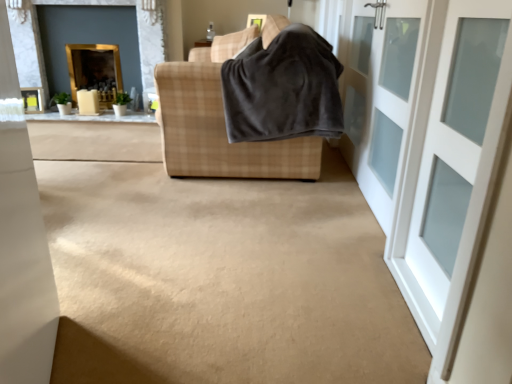
Question: Could you tell me if plaid fabric sofa at center is facing dark gray fleece blanket at center?

Choices:
 (A) no
 (B) yes

Answer: (A)

Question: Is plaid fabric sofa at center at the left side of dark gray fleece blanket at center?

Choices:
 (A) yes
 (B) no

Answer: (A)

Question: Is plaid fabric sofa at center further to the viewer compared to dark gray fleece blanket at center?

Choices:
 (A) yes
 (B) no

Answer: (A)

Question: Is plaid fabric sofa at center oriented away from dark gray fleece blanket at center?

Choices:
 (A) no
 (B) yes

Answer: (B)

Question: Is dark gray fleece blanket at center completely or partially inside plaid fabric sofa at center?

Choices:
 (A) yes
 (B) no

Answer: (A)

Question: Looking at their shapes, would you say gold-framed mirror at upper left, arranged as the 2th fireplace when viewed from the left, is wider or thinner than white glass door at right, arranged as the 1th door when viewed from the front?

Choices:
 (A) wide
 (B) thin

Answer: (A)

Question: In terms of height, does gold-framed mirror at upper left, which is the first fireplace in right-to-left order, look taller or shorter compared to white glass door at right, arranged as the 1th door when viewed from the front?

Choices:
 (A) tall
 (B) short

Answer: (A)

Question: Relative to white glass door at right, arranged as the 1th door when viewed from the front, is gold-framed mirror at upper left, arranged as the 2th fireplace when viewed from the left, in front or behind?

Choices:
 (A) behind
 (B) front

Answer: (A)

Question: From the image's perspective, relative to white glass door at right, arranged as the 1th door when viewed from the front, is gold-framed mirror at upper left, which is the first fireplace in right-to-left order, above or below?

Choices:
 (A) above
 (B) below

Answer: (A)

Question: Considering the positions of point (501, 372) and point (394, 3), is point (501, 372) closer or farther from the camera than point (394, 3)?

Choices:
 (A) closer
 (B) farther

Answer: (A)

Question: Is white glass door at right, arranged as the 1th door when viewed from the front, in front of or behind white glass door at right, marked as the 1th door in a back-to-front arrangement, in the image?

Choices:
 (A) front
 (B) behind

Answer: (A)

Question: In terms of size, does white glass door at right, arranged as the 1th door when viewed from the front, appear bigger or smaller than white glass door at right, marked as the 1th door in a back-to-front arrangement?

Choices:
 (A) big
 (B) small

Answer: (B)

Question: Is white glass door at right, acting as the second door starting from the back, situated inside white glass door at right, marked as the 1th door in a back-to-front arrangement, or outside?

Choices:
 (A) outside
 (B) inside

Answer: (A)

Question: From a real-world perspective, is gold-framed mirror at upper left, the 1th fireplace viewed from the left, positioned above or below plaid fabric sofa at center?

Choices:
 (A) below
 (B) above

Answer: (A)

Question: From the image's perspective, relative to plaid fabric sofa at center, is gold-framed mirror at upper left, the 1th fireplace viewed from the left, above or below?

Choices:
 (A) below
 (B) above

Answer: (B)